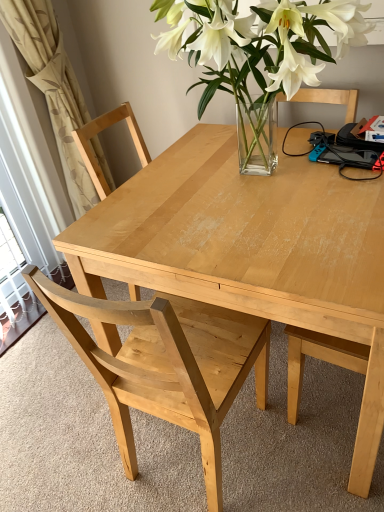
Question: Would you say natural wood table at center is a long distance from beige fabric curtain at left?

Choices:
 (A) no
 (B) yes

Answer: (A)

Question: Is beige fabric curtain at left at the back of natural wood table at center?

Choices:
 (A) yes
 (B) no

Answer: (B)

Question: Considering the relative sizes of natural wood table at center and beige fabric curtain at left in the image provided, is natural wood table at center taller than beige fabric curtain at left?

Choices:
 (A) yes
 (B) no

Answer: (B)

Question: Is the position of natural wood table at center less distant than that of beige fabric curtain at left?

Choices:
 (A) yes
 (B) no

Answer: (A)

Question: Is natural wood table at center not within beige fabric curtain at left?

Choices:
 (A) no
 (B) yes

Answer: (B)

Question: Considering the positions of point (200, 433) and point (337, 275), is point (200, 433) closer or farther from the camera than point (337, 275)?

Choices:
 (A) farther
 (B) closer

Answer: (A)

Question: In terms of size, does light wood chair at center appear bigger or smaller than natural wood table at center?

Choices:
 (A) small
 (B) big

Answer: (A)

Question: Is light wood chair at center to the left or to the right of natural wood table at center in the image?

Choices:
 (A) left
 (B) right

Answer: (A)

Question: Do you think light wood chair at center is within natural wood table at center, or outside of it?

Choices:
 (A) outside
 (B) inside

Answer: (B)

Question: In the image, is light wood chair at center on the left side or the right side of beige fabric curtain at left?

Choices:
 (A) left
 (B) right

Answer: (B)

Question: Is point (x=117, y=374) closer or farther from the camera than point (x=52, y=35)?

Choices:
 (A) farther
 (B) closer

Answer: (B)

Question: From a real-world perspective, is light wood chair at center above or below beige fabric curtain at left?

Choices:
 (A) above
 (B) below

Answer: (B)

Question: Considering the positions of light wood chair at center and beige fabric curtain at left in the image, is light wood chair at center bigger or smaller than beige fabric curtain at left?

Choices:
 (A) big
 (B) small

Answer: (A)

Question: Visually, is beige fabric curtain at left positioned to the left or to the right of natural wood table at center?

Choices:
 (A) right
 (B) left

Answer: (B)

Question: Is beige fabric curtain at left bigger or smaller than natural wood table at center?

Choices:
 (A) big
 (B) small

Answer: (B)